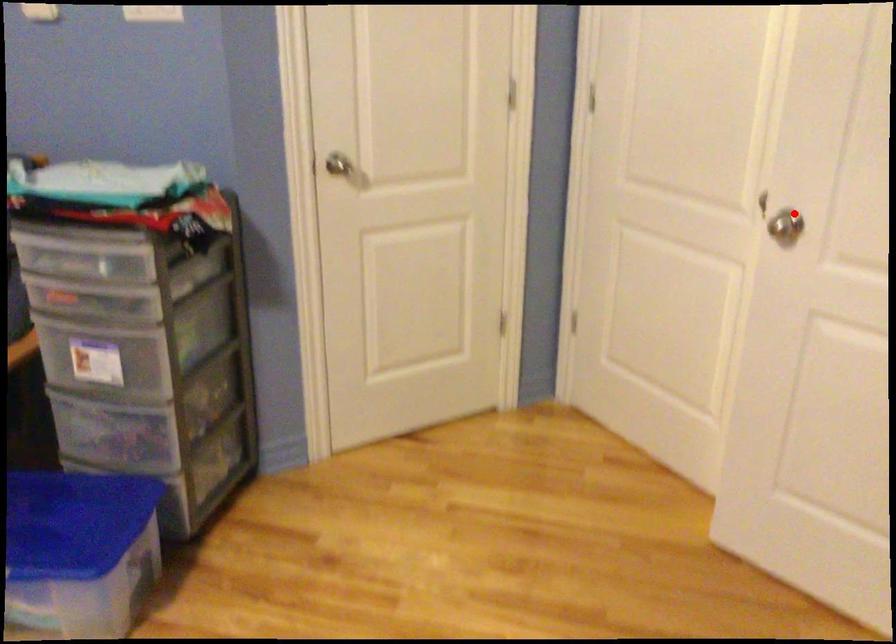
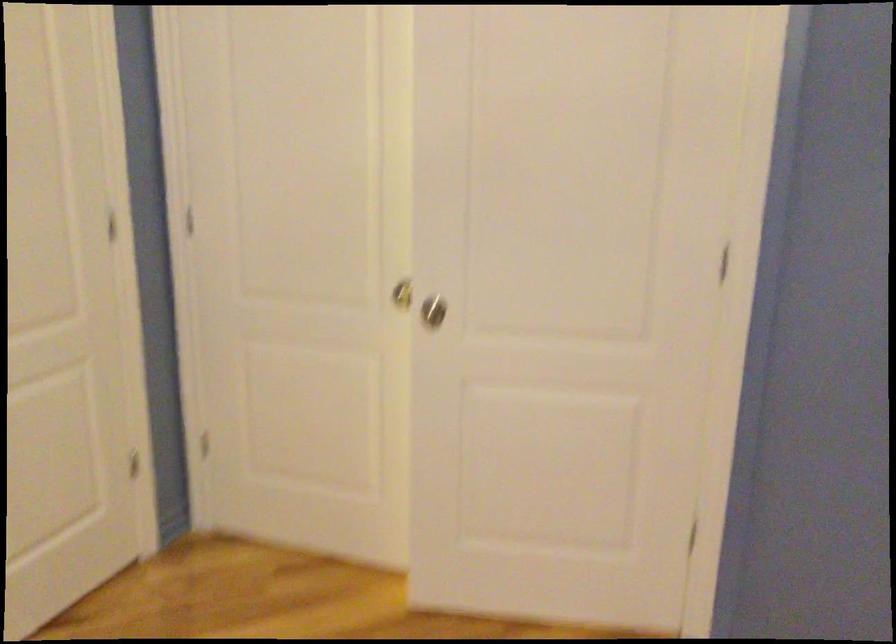
Question: I am providing you with two images of the same scene from different viewpoints. A red point is marked on the first image. Is the red point's position out of view in image 2?

Choices:
 (A) Yes
 (B) No

Answer: (B)